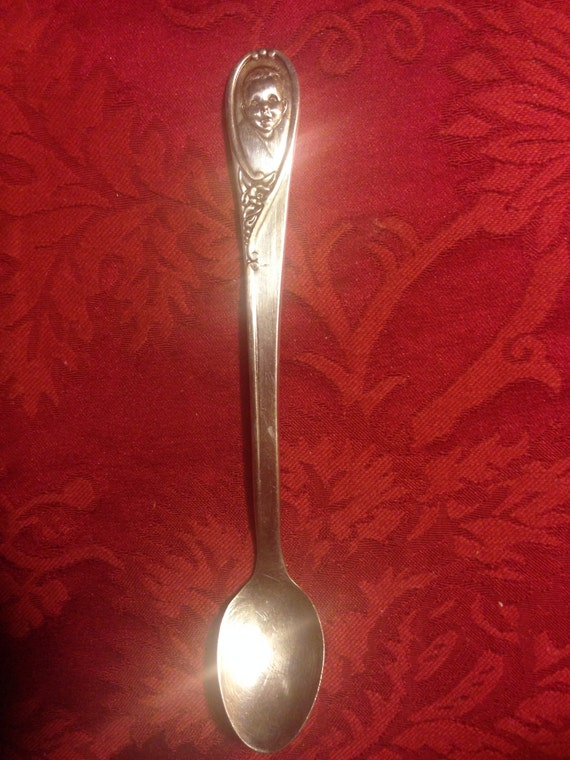
You are a GUI agent. You are given a task and a screenshot of the screen. Output one action in this format:
    pyautogui.click(x=<x>, y=<y>)
    Task: Click on the loop designs in table cloth
    
    Given the screenshot: What is the action you would take?
    pyautogui.click(x=337, y=62), pyautogui.click(x=399, y=55)